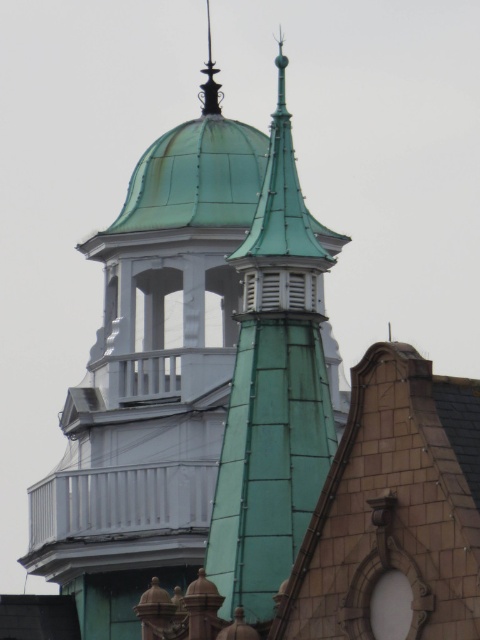
Question: Is green copper roof at center in front of polished dark metal spire at upper center?

Choices:
 (A) yes
 (B) no

Answer: (A)

Question: Which point is farther to the camera?

Choices:
 (A) polished dark metal spire at upper center
 (B) green copper roof at center

Answer: (A)

Question: Can you confirm if green copper roof at center is bigger than polished dark metal spire at upper center?

Choices:
 (A) yes
 (B) no

Answer: (A)

Question: Does green copper roof at center appear on the right side of polished dark metal spire at upper center?

Choices:
 (A) no
 (B) yes

Answer: (B)

Question: Among these objects, which one is nearest to the camera?

Choices:
 (A) polished dark metal spire at upper center
 (B) green copper roof at center

Answer: (B)